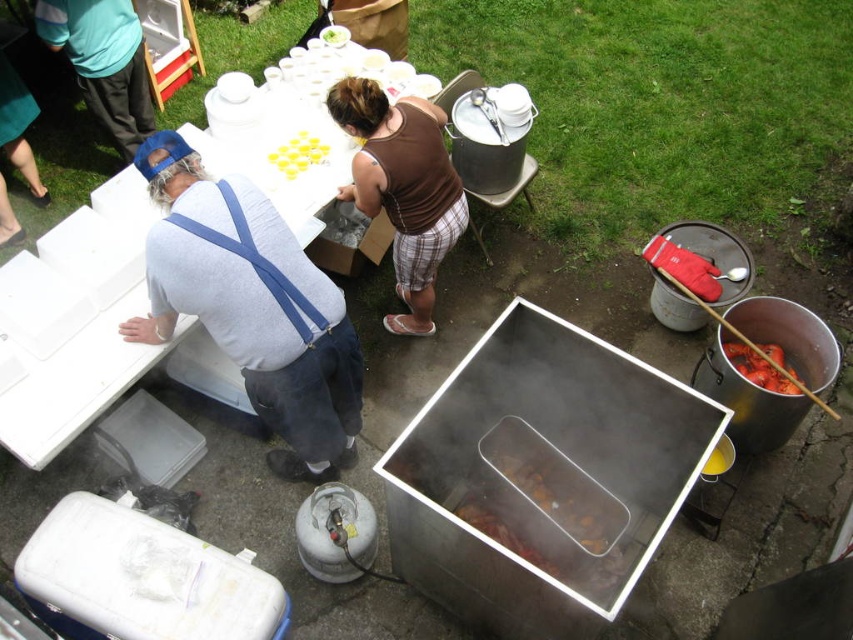
You are at a community event and see the green cotton shirt at upper left and the yellow plastic cups at upper center. Which object is located to the left of the other?

The green cotton shirt at upper left is positioned on the left side of yellow plastic cups at upper center.

You are organizing a community event and need to decide which clothing item to use as a makeshift apron. Given the sizes of the brown cotton tank top at center and the green cotton shirt at upper left, which one would be more suitable for covering a larger cooking area?

The brown cotton tank top at center has a larger size compared to the green cotton shirt at upper left, so it would be more suitable for covering a larger cooking area.

You are a photographer trying to capture both the green cotton shirt at upper left and the shiny silver lobster at right in a single shot. Based on their heights, which object should you focus on first to ensure both are in frame?

The green cotton shirt at upper left is taller than the shiny silver lobster at right, so you should focus on the green cotton shirt at upper left first to ensure both are in frame.